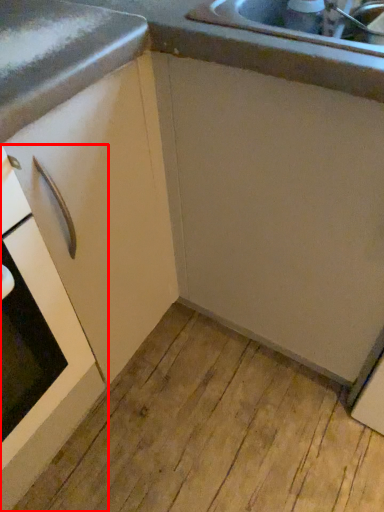
Question: Considering the relative positions of home appliance (annotated by the red box) and cabinetry in the image provided, where is home appliance (annotated by the red box) located with respect to the staircase?

Choices:
 (A) left
 (B) right

Answer: (A)